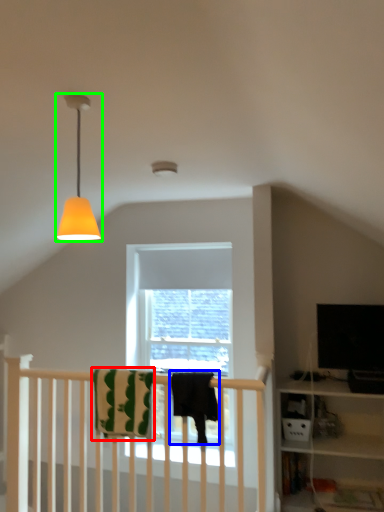
Question: Considering the real-world distances, which object is closest to beach towel (highlighted by a red box)? beach towel (highlighted by a blue box) or lamp (highlighted by a green box).

Choices:
 (A) beach towel
 (B) lamp

Answer: (A)